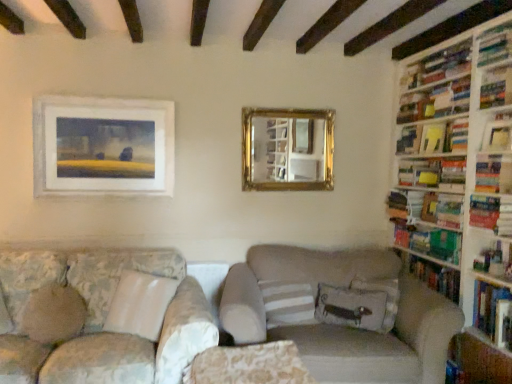
Question: Does hardcover books at upper right, which is the third shelf from bottom to top, have a lesser height compared to green matte bookshelf at right, positioned as the 8th book in top-to-bottom order?

Choices:
 (A) yes
 (B) no

Answer: (B)

Question: Considering the relative sizes of hardcover books at upper right, positioned as the 1th shelf in top-to-bottom order, and green matte bookshelf at right, positioned as the 8th book in top-to-bottom order, in the image provided, is hardcover books at upper right, positioned as the 1th shelf in top-to-bottom order, taller than green matte bookshelf at right, positioned as the 8th book in top-to-bottom order,?

Choices:
 (A) no
 (B) yes

Answer: (B)

Question: Could you tell me if hardcover books at upper right, positioned as the 1th shelf in top-to-bottom order, is facing green matte bookshelf at right, positioned as the 8th book in top-to-bottom order?

Choices:
 (A) yes
 (B) no

Answer: (B)

Question: From the image's perspective, is hardcover books at upper right, positioned as the 1th shelf in top-to-bottom order, beneath green matte bookshelf at right, positioned as the 8th book in top-to-bottom order?

Choices:
 (A) yes
 (B) no

Answer: (B)

Question: Does hardcover books at upper right, which is the third shelf from bottom to top, have a larger size compared to green matte bookshelf at right, positioned as the 8th book in top-to-bottom order?

Choices:
 (A) yes
 (B) no

Answer: (B)

Question: From their relative heights in the image, would you say white matte painting at upper left, which appears as the second picture frame when viewed from the right, is taller or shorter than yellow paper at upper right, which appears as the 4th book when viewed from the top?

Choices:
 (A) tall
 (B) short

Answer: (A)

Question: From the image's perspective, is white matte painting at upper left, the 1th picture frame viewed from the left, above or below yellow paper at upper right, which appears as the 4th book when viewed from the top?

Choices:
 (A) below
 (B) above

Answer: (A)

Question: Relative to yellow paper at upper right, which is counted as the 6th book, starting from the bottom, is white matte painting at upper left, arranged as the second picture frame when viewed from the back, in front or behind?

Choices:
 (A) behind
 (B) front

Answer: (A)

Question: Considering the positions of point (160, 119) and point (413, 145), is point (160, 119) closer or farther from the camera than point (413, 145)?

Choices:
 (A) closer
 (B) farther

Answer: (A)

Question: Is point (493, 69) closer or farther from the camera than point (289, 319)?

Choices:
 (A) farther
 (B) closer

Answer: (B)

Question: In terms of width, does hardcover books at upper right, positioned as the 1th shelf in top-to-bottom order, look wider or thinner when compared to white striped pillow at center, which is counted as the 2th pillow, starting from the right?

Choices:
 (A) wide
 (B) thin

Answer: (B)

Question: From the image's perspective, relative to white striped pillow at center, which is counted as the 2th pillow, starting from the right, is hardcover books at upper right, positioned as the 1th shelf in top-to-bottom order, above or below?

Choices:
 (A) above
 (B) below

Answer: (A)

Question: Considering the positions of hardcover books at upper right, which is the third shelf from bottom to top, and white striped pillow at center, which is counted as the 2th pillow, starting from the right, in the image, is hardcover books at upper right, which is the third shelf from bottom to top, taller or shorter than white striped pillow at center, which is counted as the 2th pillow, starting from the right,?

Choices:
 (A) tall
 (B) short

Answer: (B)

Question: From a real-world perspective, is velvet floral pillow at center, which ranks as the third pillow in left-to-right order, physically located above or below hardcover book at right, the sixth book positioned from the top?

Choices:
 (A) below
 (B) above

Answer: (A)

Question: From their relative heights in the image, would you say velvet floral pillow at center, the first pillow from the right, is taller or shorter than hardcover book at right, the sixth book positioned from the top?

Choices:
 (A) short
 (B) tall

Answer: (B)